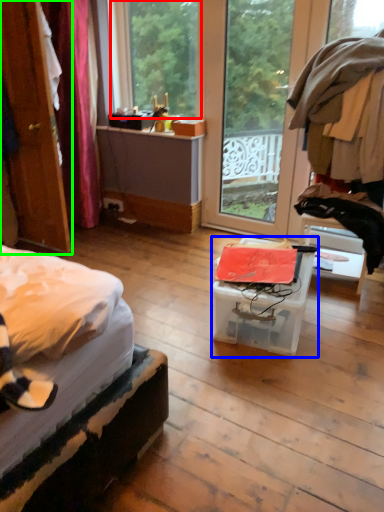
Question: Based on their relative distances, which object is farther from window (highlighted by a red box)? Choose from box (highlighted by a blue box) and door (highlighted by a green box).

Choices:
 (A) box
 (B) door

Answer: (A)